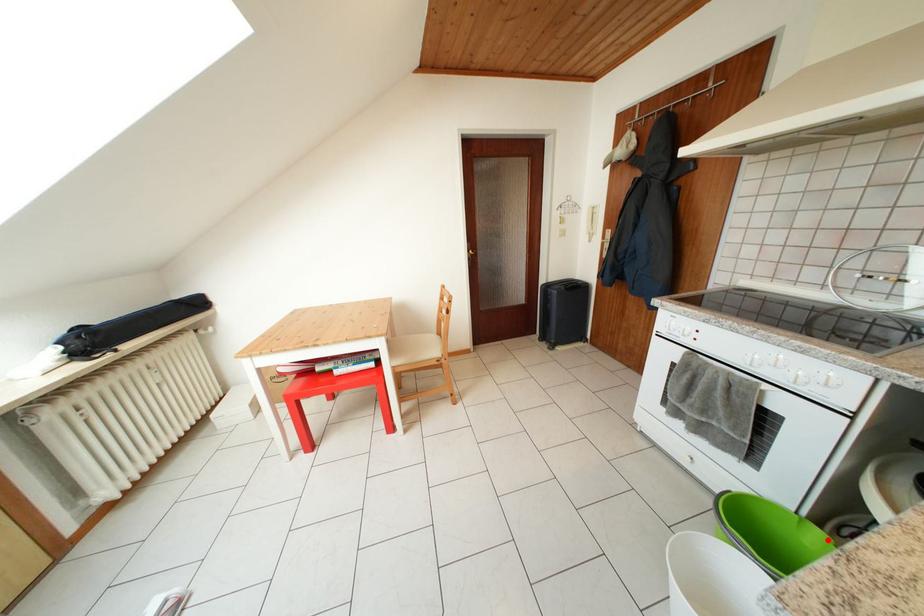
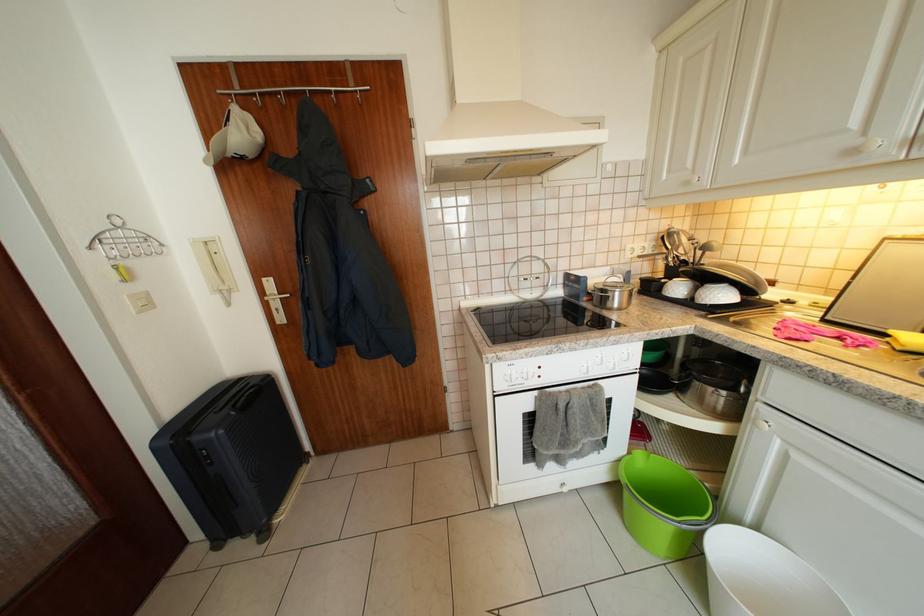
Find the pixel in the second image that matches the highlighted location in the first image.

(648, 459)